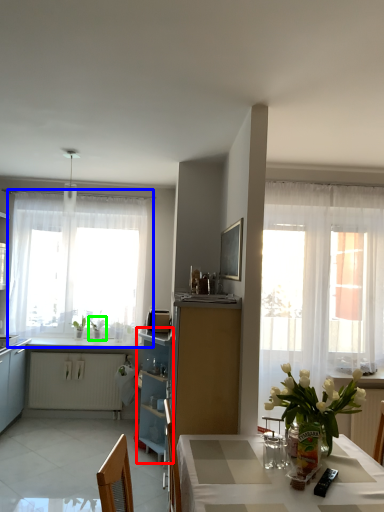
Question: Which is farther away from cabinetry (highlighted by a red box)? window (highlighted by a blue box) or plant (highlighted by a green box)?

Choices:
 (A) window
 (B) plant

Answer: (A)